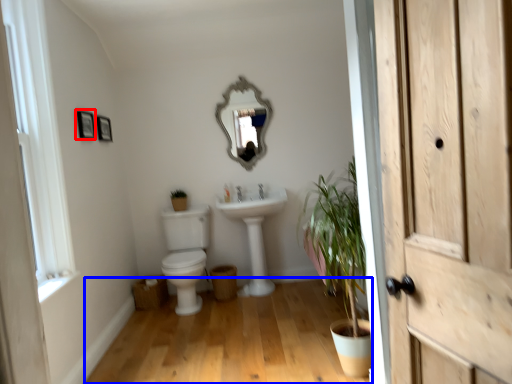
Question: Which point is further to the camera, picture frame (highlighted by a red box) or plain (highlighted by a blue box)?

Choices:
 (A) picture frame
 (B) plain

Answer: (A)